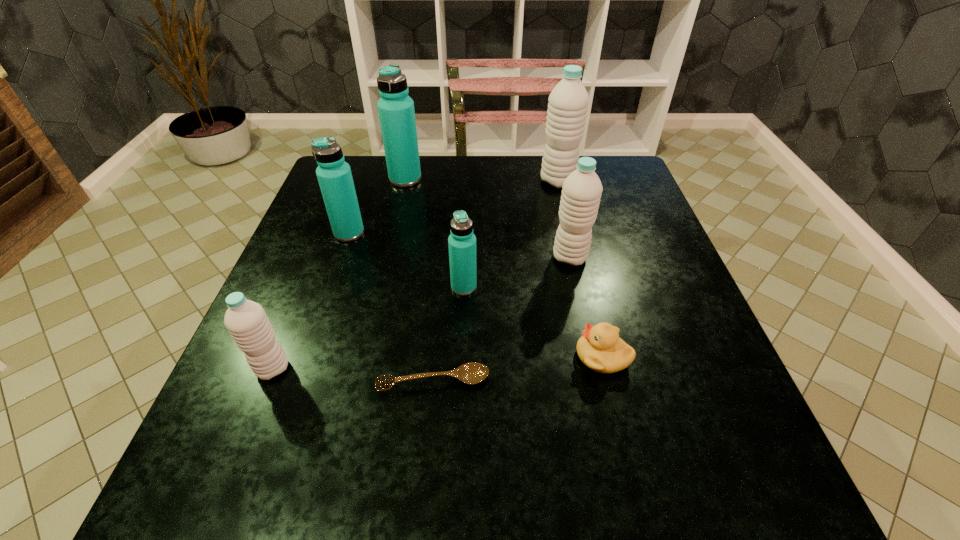
This screenshot has width=960, height=540. Identify the location of vacant area situated on the beak of the duckling. (542, 357).

Find the location of `vacant space situated 0.140m on the beak of the duckling`. vacant space situated 0.140m on the beak of the duckling is located at coordinates (498, 357).

Where is `vacant space located on the beak of the duckling`? The height and width of the screenshot is (540, 960). vacant space located on the beak of the duckling is located at coordinates (542, 357).

Image resolution: width=960 pixels, height=540 pixels. Find the location of `free space located on the back of the shortest object`. free space located on the back of the shortest object is located at coordinates (444, 260).

Where is `object that is at the right edge`? This screenshot has width=960, height=540. object that is at the right edge is located at coordinates pyautogui.click(x=600, y=348).

Find the location of a particular element. The image size is (960, 540). free space at the far edge of the desktop is located at coordinates (480, 195).

You are a GUI agent. You are given a task and a screenshot of the screen. Output one action in this format:
    pyautogui.click(x=<x>, y=<y>)
    Task: Click on the vacant space at the near edge of the desktop
    This screenshot has width=960, height=540.
    Given the screenshot: What is the action you would take?
    click(x=601, y=464)

At what (x,y) coordinates should I click in order to perform the action: click on vacant space at the left edge of the desktop. Please return your answer as a coordinate pair (x, y). Looking at the image, I should click on (300, 288).

The height and width of the screenshot is (540, 960). Find the location of `free space at the right edge`. free space at the right edge is located at coordinates (695, 318).

Identify the location of vacant area at the far right corner of the desktop. (610, 193).